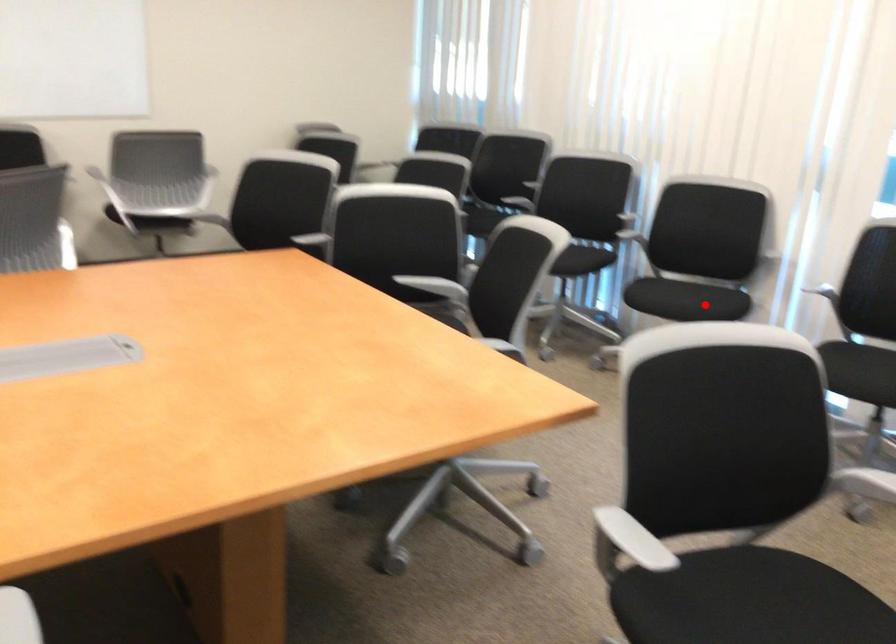
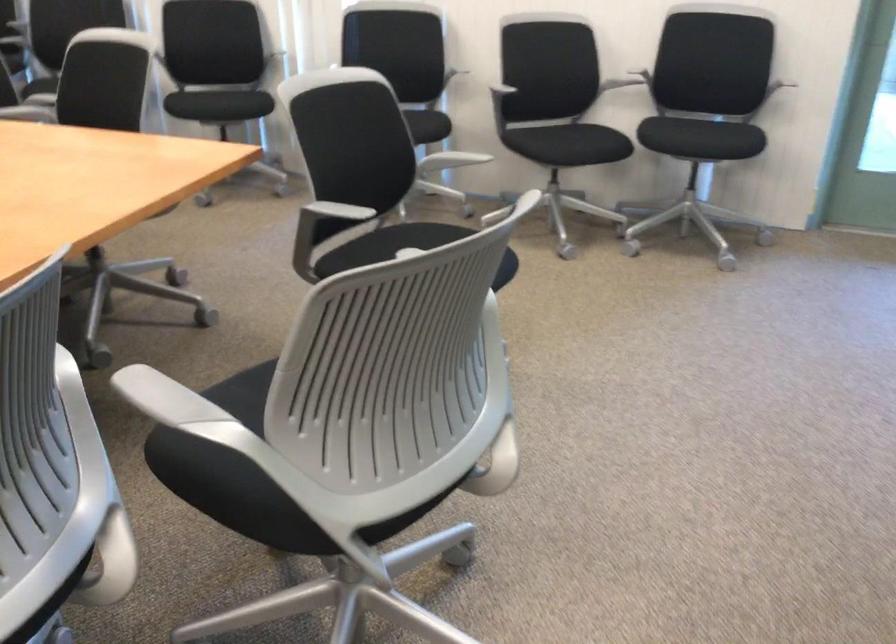
Find the pixel in the second image that matches the highlighted location in the first image.

(238, 102)